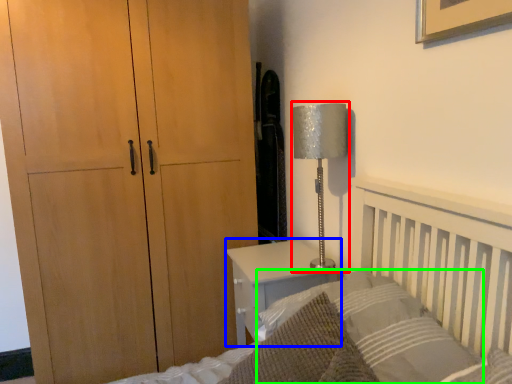
Question: Which object is positioned farthest from table lamp (highlighted by a red box)? Select from nightstand (highlighted by a blue box) and pillow (highlighted by a green box).

Choices:
 (A) nightstand
 (B) pillow

Answer: (B)